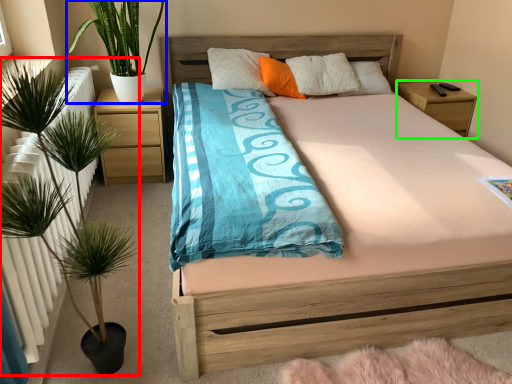
Question: Based on their relative distances, which object is nearer to houseplant (highlighted by a red box)? Choose from houseplant (highlighted by a blue box) and nightstand (highlighted by a green box).

Choices:
 (A) houseplant
 (B) nightstand

Answer: (A)